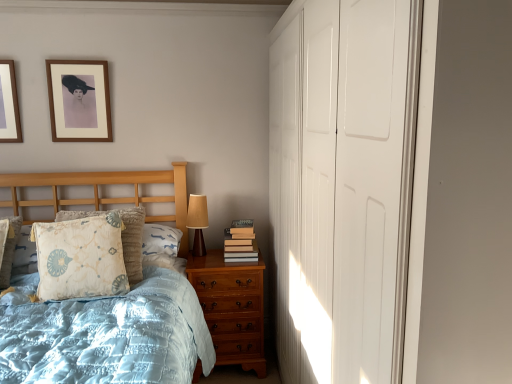
Where is `vacant area that lies between hardcover books at right and matte brown wood table lamp at right`? This screenshot has width=512, height=384. vacant area that lies between hardcover books at right and matte brown wood table lamp at right is located at coordinates (209, 261).